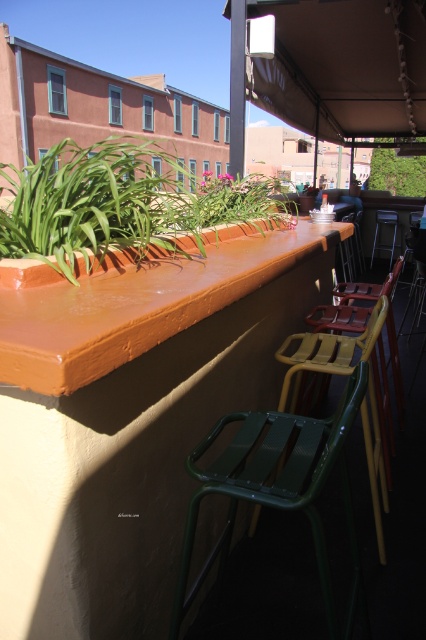
You are a customer at the outdoor seating area and want to place a small potted herb on the counter. The potted herb is the same size as the metallic green chair at center. Will the green matte plant at upper right fit on the counter if you place the herb next to it?

The green matte plant at upper right is bigger than the metallic green chair at center. Since the potted herb is the same size as the metallic green chair at center, the green matte plant at upper right may not fit on the counter if placed next to the herb due to its larger size.

You are a customer looking for a seat at the outdoor seating area. You see the green matte plant at upper right and the metallic green chair at center. Which object is closer to the right edge of the image?

The green matte plant at upper right is positioned on the right side of the metallic green chair at center, so the green matte plant at upper right is closer to the right edge of the image.

You are a person with a 32 inch wide backpack. You want to walk through the space between the green metal chair at center and the nearest object to it. Is there enough space for you and your backpack to pass through comfortably?

The space between the green metal chair at center and the nearest object is 36.09 inches. Since your backpack is 32 inches wide, there is enough space for you and your backpack to pass through comfortably as 36.09 inches is wider than 32 inches.